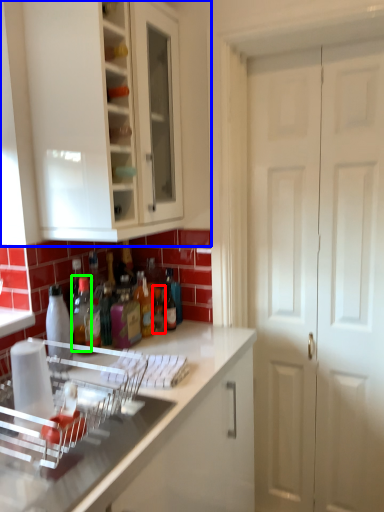
Question: Which is nearer to the bottle (highlighted by a red box)? cabinetry (highlighted by a blue box) or bottle (highlighted by a green box).

Choices:
 (A) cabinetry
 (B) bottle

Answer: (B)